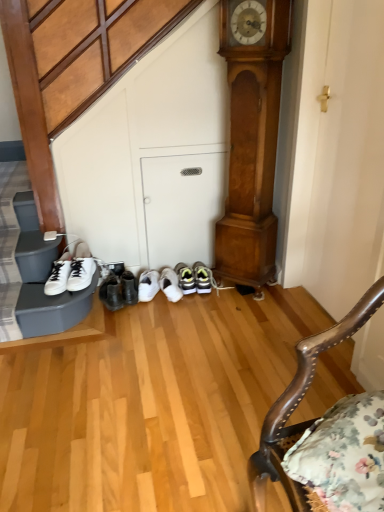
Where is `free spot in front of polished wood grandfather clock at center`? This screenshot has width=384, height=512. free spot in front of polished wood grandfather clock at center is located at coordinates (246, 310).